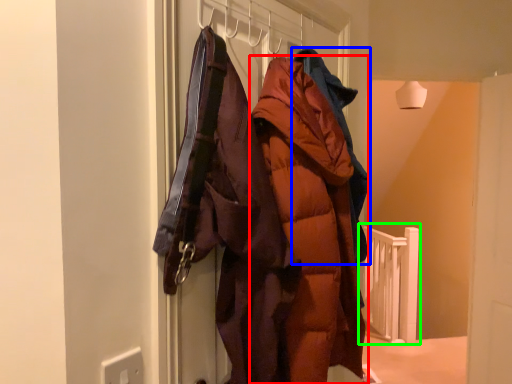
Question: Considering the real-world distances, which object is closest to coat (highlighted by a red box)? jacket (highlighted by a blue box) or rail (highlighted by a green box).

Choices:
 (A) jacket
 (B) rail

Answer: (A)